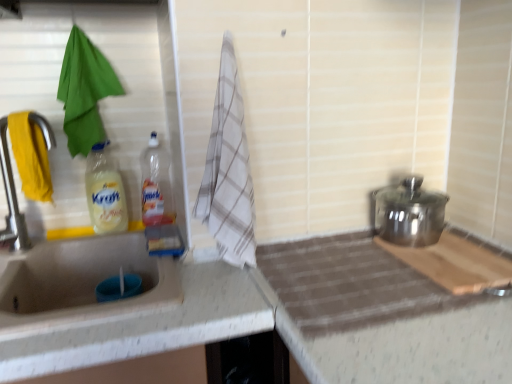
Where is `vacant area to the left of yellow matte bottle at sink left, the second bottle when ordered from right to left`? Image resolution: width=512 pixels, height=384 pixels. vacant area to the left of yellow matte bottle at sink left, the second bottle when ordered from right to left is located at coordinates (46, 239).